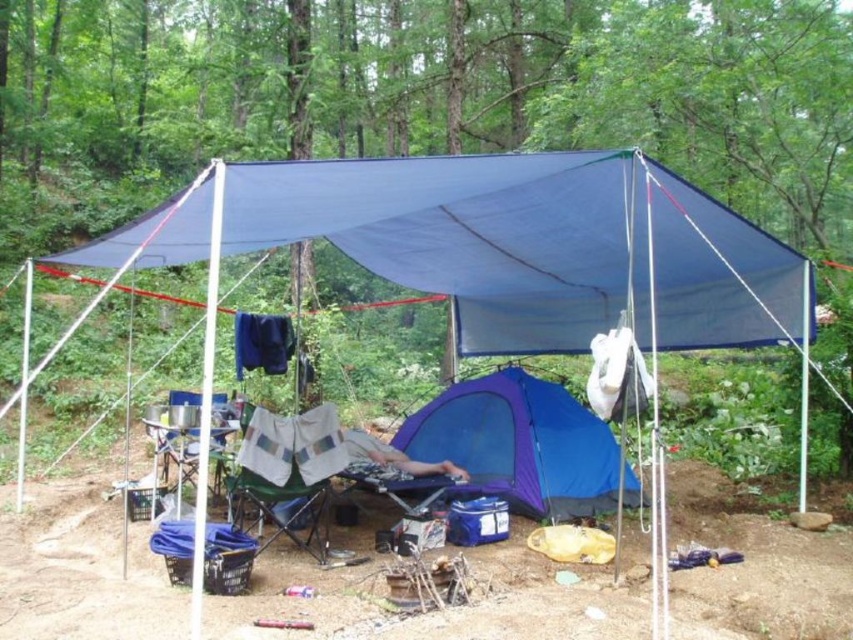
Question: Is blue fabric tent at center behind blue nylon tent at center?

Choices:
 (A) yes
 (B) no

Answer: (B)

Question: Does blue fabric tent at center have a larger size compared to blue nylon tent at center?

Choices:
 (A) no
 (B) yes

Answer: (B)

Question: Among these objects, which one is farthest from the camera?

Choices:
 (A) blue fabric tent at center
 (B) blue nylon tent at center

Answer: (B)

Question: Which of the following is the closest to the observer?

Choices:
 (A) blue nylon tent at center
 (B) blue fabric tent at center

Answer: (B)

Question: Can you confirm if blue fabric tent at center is smaller than blue nylon tent at center?

Choices:
 (A) yes
 (B) no

Answer: (B)